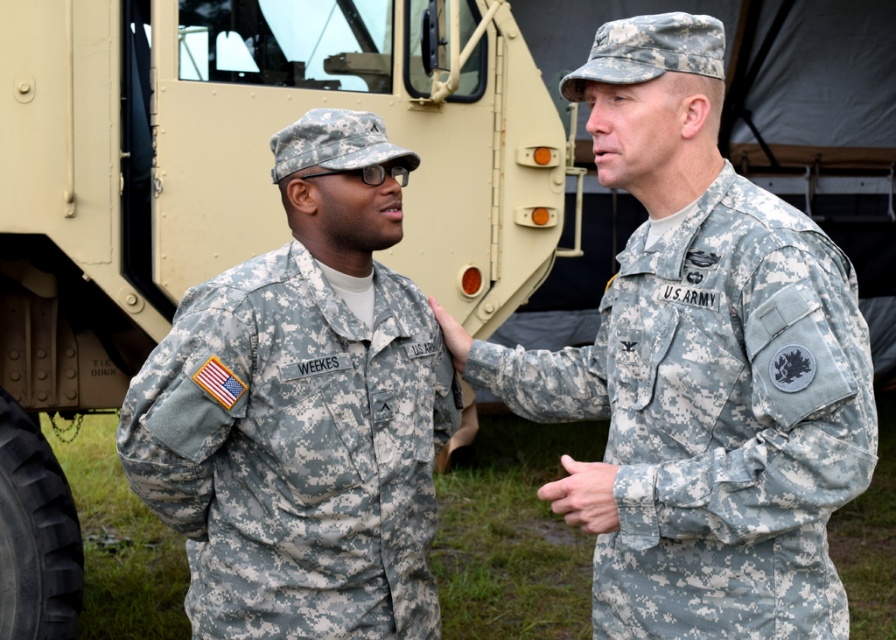
In the scene shown: Can you confirm if tan matte truck at upper left is positioned to the left of camouflage fabric uniform at left?

Correct, you'll find tan matte truck at upper left to the left of camouflage fabric uniform at left.

Is tan matte truck at upper left bigger than camouflage fabric uniform at left?

Yes, tan matte truck at upper left is bigger than camouflage fabric uniform at left.

Is point (336, 74) in front of point (403, 509)?

That is False.

In order to click on tan matte truck at upper left in this screenshot , I will do `click(224, 198)`.

Does camouflage fabric us army uniform at right appear on the left side of camouflage fabric uniform at left?

Incorrect, camouflage fabric us army uniform at right is not on the left side of camouflage fabric uniform at left.

Is camouflage fabric us army uniform at right to the right of camouflage fabric uniform at left from the viewer's perspective?

Yes, camouflage fabric us army uniform at right is to the right of camouflage fabric uniform at left.

Who is more forward, [705,397] or [213,436]?

Point [705,397] is more forward.

This screenshot has width=896, height=640. I want to click on camouflage fabric us army uniform at right, so click(x=716, y=420).

Between tan matte truck at upper left and camouflage fabric us army uniform at right, which one has less height?

camouflage fabric us army uniform at right

How far apart are tan matte truck at upper left and camouflage fabric us army uniform at right?

tan matte truck at upper left and camouflage fabric us army uniform at right are 6.76 feet apart.

Is point (412, 102) positioned in front of point (780, 595)?

No, (412, 102) is behind (780, 595).

You are a GUI agent. You are given a task and a screenshot of the screen. Output one action in this format:
    pyautogui.click(x=<x>, y=<y>)
    Task: Click on the tan matte truck at upper left
    The height and width of the screenshot is (640, 896).
    Given the screenshot: What is the action you would take?
    pyautogui.click(x=224, y=198)